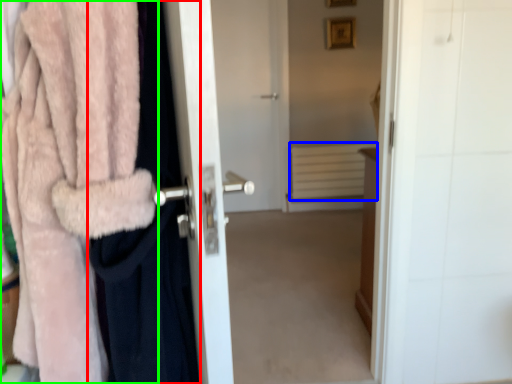
Question: Based on their relative distances, which object is farther from clothing (highlighted by a red box)? Choose from radiator (highlighted by a blue box) and towel (highlighted by a green box).

Choices:
 (A) radiator
 (B) towel

Answer: (A)